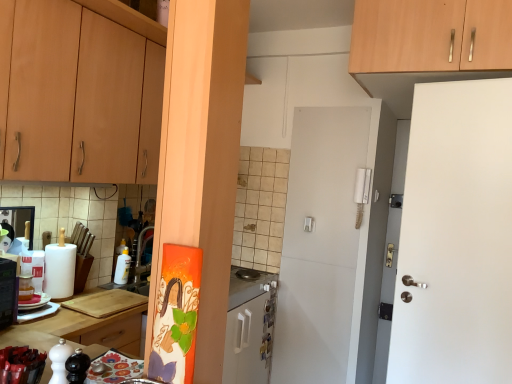
You are a GUI agent. You are given a task and a screenshot of the screen. Output one action in this format:
    pyautogui.click(x=<x>, y=<y>)
    Task: Click on the white plastic salt shaker at lower left
    
    Given the screenshot: What is the action you would take?
    pyautogui.click(x=21, y=365)

What do you see at coordinates (430, 35) in the screenshot? Image resolution: width=512 pixels, height=384 pixels. I see `wooden cabinet at upper right, the 1th cabinetry viewed from the right` at bounding box center [430, 35].

What do you see at coordinates (77, 96) in the screenshot? I see `wooden cabinet at upper left, which appears as the second cabinetry when viewed from the right` at bounding box center [77, 96].

Where is `stainless steel gas stove at center`? The width and height of the screenshot is (512, 384). stainless steel gas stove at center is located at coordinates (246, 287).

Find the location of a particular element. This screenshot has height=384, width=512. white paper towel at left, the 2th appliance when ordered from right to left is located at coordinates (60, 269).

This screenshot has width=512, height=384. In order to click on countertop located underneath the wooden cutting board at lower left (from a real-world perspective) in this screenshot , I will do `click(74, 330)`.

Which object is thinner, wooden cutting board at lower left or wooden cutting board at lower center?

wooden cutting board at lower left.

Considering the positions of points (131, 317) and (121, 315), is point (131, 317) closer to camera compared to point (121, 315)?

That is False.

Considering the positions of objects wooden cutting board at lower left and wooden cutting board at lower center in the image provided, who is more to the right, wooden cutting board at lower left or wooden cutting board at lower center?

From the viewer's perspective, wooden cutting board at lower center appears more on the right side.

Measure the distance between wooden cabinet at upper right, the 1th cabinetry viewed from the right, and stainless steel gas stove at center.

wooden cabinet at upper right, the 1th cabinetry viewed from the right, and stainless steel gas stove at center are 5.32 feet apart.

From a real-world perspective, who is located higher, wooden cabinet at upper right, which is the 2th cabinetry from left to right, or stainless steel gas stove at center?

wooden cabinet at upper right, which is the 2th cabinetry from left to right.

Is point (362, 35) in front of point (272, 277)?

That is True.

Considering the relative sizes of white plastic salt shaker at lower left and wooden cutting board at lower left in the image provided, is white plastic salt shaker at lower left wider than wooden cutting board at lower left?

Incorrect, the width of white plastic salt shaker at lower left does not surpass that of wooden cutting board at lower left.

Which of these two, white plastic salt shaker at lower left or wooden cutting board at lower left, is smaller?

Smaller between the two is white plastic salt shaker at lower left.

Is white plastic salt shaker at lower left behind wooden cutting board at lower left?

No, it is in front of wooden cutting board at lower left.

From the image's perspective, is white plastic salt shaker at lower left located beneath wooden cutting board at lower left?

No, from the image's perspective, white plastic salt shaker at lower left is not beneath wooden cutting board at lower left.

From a real-world perspective, which object rests below the other?

wooden cutting board at lower center.

From the image's perspective, is wooden cutting board at lower center above or below white paper towel at left, the 2th appliance when ordered from right to left?

wooden cutting board at lower center is below white paper towel at left, the 2th appliance when ordered from right to left.

Is wooden cutting board at lower center not near white paper towel at left, the 2th appliance when ordered from right to left?

They are positioned close to each other.

Is wooden cutting board at lower center positioned beyond the bounds of white paper towel at left, the 2th appliance when ordered from back to front?

wooden cutting board at lower center lies outside white paper towel at left, the 2th appliance when ordered from back to front,'s area.

How different are the orientations of white paper towel at left, arranged as the 1th appliance when viewed from the front, and wooden cutting board at lower center in degrees?

They differ by 2.48 degrees in their facing directions.

Between point (69, 260) and point (247, 375), which one is positioned behind?

Point (247, 375)

Is wooden cutting board at lower center inside white paper towel at left, the 2th appliance when ordered from right to left?

No, wooden cutting board at lower center is not surrounded by white paper towel at left, the 2th appliance when ordered from right to left.

Based on the photo, is white paper towel at left, which is counted as the 1th appliance, starting from the left, to the right of wooden cutting board at lower left from the viewer's perspective?

No.

Based on the photo, measure the distance between white paper towel at left, the 2th appliance when ordered from right to left, and wooden cutting board at lower left.

11.71 inches.

Which is behind, point (68, 262) or point (4, 330)?

The point (68, 262) is farther from the camera.

From the image's perspective, which one is positioned higher, white paper towel at left, arranged as the 1th appliance when viewed from the front, or wooden cutting board at lower left?

white paper towel at left, arranged as the 1th appliance when viewed from the front, is shown above in the image.

From the image's perspective, would you say wooden cabinet at upper right, which is the 2th cabinetry from left to right, is shown under white plastic salt shaker at lower left?

Incorrect, from the image's perspective, wooden cabinet at upper right, which is the 2th cabinetry from left to right, is higher than white plastic salt shaker at lower left.

How different are the orientations of wooden cabinet at upper right, which is the 2th cabinetry from left to right, and white plastic salt shaker at lower left in degrees?

They differ by 3.71 degrees in their facing directions.

Considering the sizes of objects wooden cabinet at upper right, which is the 2th cabinetry from left to right, and white plastic salt shaker at lower left in the image provided, who is wider, wooden cabinet at upper right, which is the 2th cabinetry from left to right, or white plastic salt shaker at lower left?

Wider between the two is wooden cabinet at upper right, which is the 2th cabinetry from left to right.

Would you consider wooden cabinet at upper right, the 1th cabinetry viewed from the right, to be distant from white plastic salt shaker at lower left?

Yes, wooden cabinet at upper right, the 1th cabinetry viewed from the right, is far from white plastic salt shaker at lower left.

Locate an element on the screen. The width and height of the screenshot is (512, 384). countertop located underneath the wooden cutting board at lower left (from a real-world perspective) is located at coordinates (74, 330).

Find the location of `the 1st cabinetry in front when counting from the stainless steel gas stove at center`. the 1st cabinetry in front when counting from the stainless steel gas stove at center is located at coordinates (430, 35).

Which object lies nearer to the anchor point wooden cabinet at upper right, which is the 2th cabinetry from left to right, white plastic salt shaker at lower left or white plastic bottle at center, which appears as the second appliance when viewed from the left?

Based on the image, white plastic bottle at center, which appears as the second appliance when viewed from the left, appears to be nearer to wooden cabinet at upper right, which is the 2th cabinetry from left to right.

Considering their positions, is wooden cabinet at upper left, which appears as the second cabinetry when viewed from the right, positioned further to wooden cutting board at lower left than white plastic salt shaker at lower left?

wooden cabinet at upper left, which appears as the second cabinetry when viewed from the right, lies further to wooden cutting board at lower left than the other object.

Which object lies nearer to the anchor point white paper towel at left, the 2th appliance when ordered from right to left, wooden cutting board at lower left or white plastic bottle at center, the 2th appliance positioned from the front?

wooden cutting board at lower left is closer to white paper towel at left, the 2th appliance when ordered from right to left.

Looking at the image, which one is located further to white paper towel at left, which is counted as the 1th appliance, starting from the left, white plastic bottle at center, which is the 1th appliance from back to front, or wooden cutting board at lower center?

The object further to white paper towel at left, which is counted as the 1th appliance, starting from the left, is wooden cutting board at lower center.

Consider the image. Based on their spatial positions, is white plastic bottle at center, which is the 1th appliance from right to left, or stainless steel gas stove at center closer to white plastic salt shaker at lower left?

Among the two, white plastic bottle at center, which is the 1th appliance from right to left, is located nearer to white plastic salt shaker at lower left.

Estimate the real-world distances between objects in this image. Which object is closer to wooden cabinet at upper right, which is the 2th cabinetry from left to right, wooden cutting board at lower left or white plastic salt shaker at lower left?

wooden cutting board at lower left lies closer to wooden cabinet at upper right, which is the 2th cabinetry from left to right, than the other object.

When comparing their distances from white plastic bottle at center, which appears as the second appliance when viewed from the left, does wooden cabinet at upper left, which appears as the second cabinetry when viewed from the right, or wooden cutting board at lower center seem closer?

wooden cutting board at lower center is closer to white plastic bottle at center, which appears as the second appliance when viewed from the left.

Considering their positions, is wooden cutting board at lower left positioned closer to wooden cabinet at upper right, the 1th cabinetry viewed from the right, than stainless steel gas stove at center?

stainless steel gas stove at center is positioned closer to the anchor wooden cabinet at upper right, the 1th cabinetry viewed from the right.

Find the location of a particular element. appliance between white paper towel at left, which is counted as the 1th appliance, starting from the left, and stainless steel gas stove at center, in the horizontal direction is located at coordinates (122, 267).

In order to click on appliance between wooden cutting board at lower center and white plastic bottle at center, which is the 1th appliance from back to front, along the z-axis in this screenshot , I will do `click(60, 269)`.

Find the location of a particular element. gas stove between wooden cutting board at lower left and wooden cabinet at upper right, which is the 2th cabinetry from left to right is located at coordinates (246, 287).

You are a GUI agent. You are given a task and a screenshot of the screen. Output one action in this format:
    pyautogui.click(x=<x>, y=<y>)
    Task: Click on the gas stove situated between wooden cabinet at upper left, which appears as the second cabinetry when viewed from the right, and wooden cabinet at upper right, which is the 2th cabinetry from left to right, from left to right
    This screenshot has height=384, width=512.
    Given the screenshot: What is the action you would take?
    pyautogui.click(x=246, y=287)